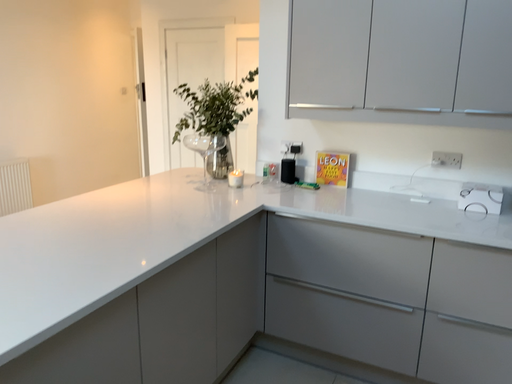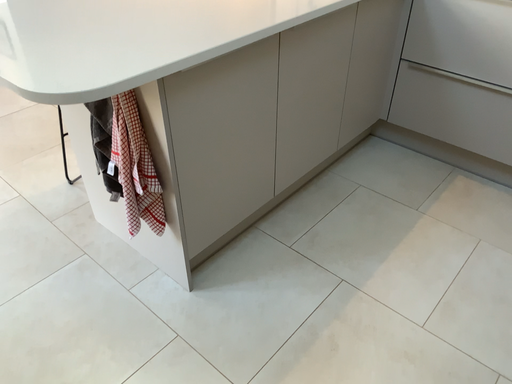
Question: How did the camera likely rotate when shooting the video?

Choices:
 (A) rotated upward
 (B) rotated downward

Answer: (B)